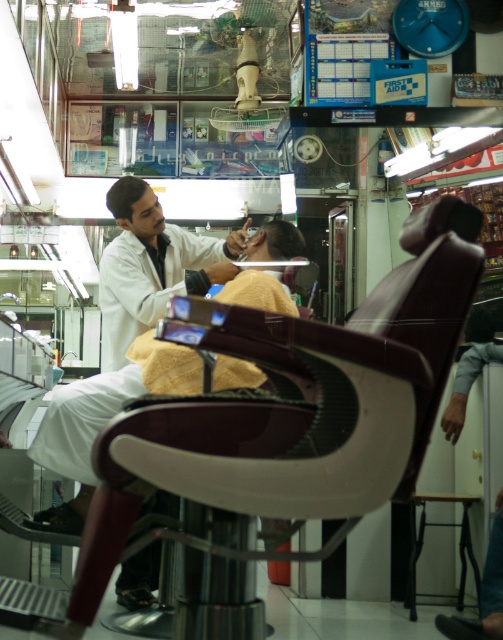
Question: Which point is farther to the camera?

Choices:
 (A) yellow towel at center
 (B) white matte barber at center

Answer: (B)

Question: Does yellow towel at center appear under shiny black hair at center?

Choices:
 (A) no
 (B) yes

Answer: (B)

Question: Does white matte barber at center appear on the right side of metallic stool at lower right?

Choices:
 (A) yes
 (B) no

Answer: (B)

Question: Among these objects, which one is farthest from the camera?

Choices:
 (A) white matte barber at center
 (B) metallic stool at lower right
 (C) dark brown hair at center

Answer: (B)

Question: Which point is closer to the camera?

Choices:
 (A) dark brown hair at center
 (B) metallic stool at lower right
 (C) yellow towel at center

Answer: (C)

Question: Is white matte barber at center to the left of dark brown hair at center from the viewer's perspective?

Choices:
 (A) yes
 (B) no

Answer: (B)